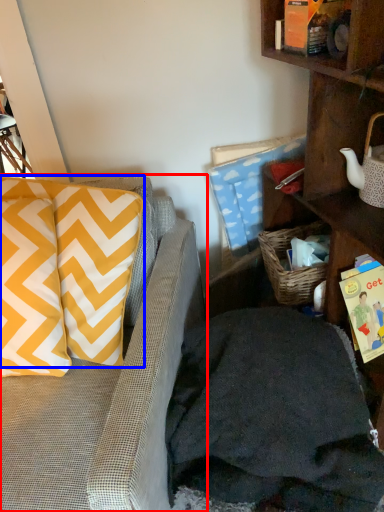
Question: Among these objects, which one is nearest to the camera, studio couch (highlighted by a red box) or pillow (highlighted by a blue box)?

Choices:
 (A) studio couch
 (B) pillow

Answer: (A)